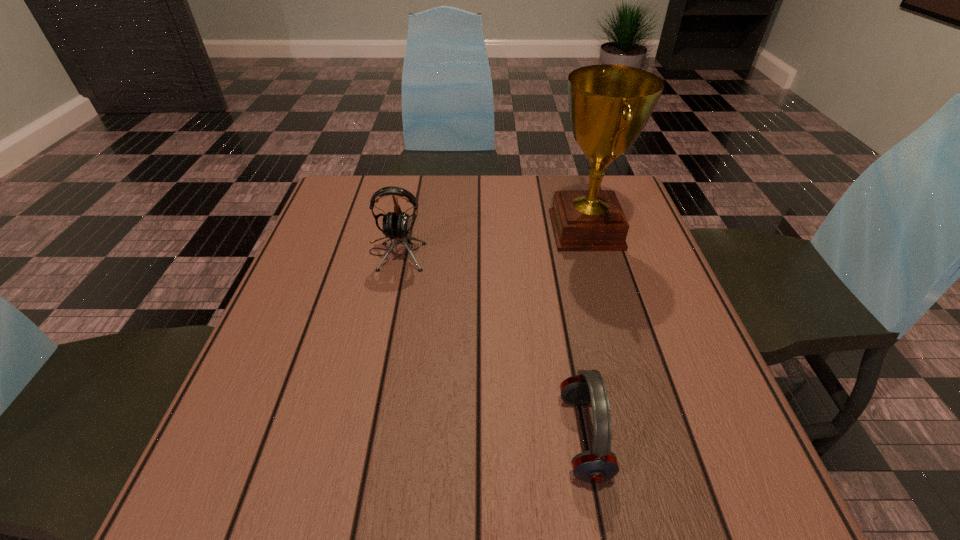
Locate an element on the screen. free space located on the ear cups of the shorter earphone is located at coordinates (328, 437).

You are a GUI agent. You are given a task and a screenshot of the screen. Output one action in this format:
    pyautogui.click(x=<x>, y=<y>)
    Task: Click on the vacant space situated 0.250m on the ear cups of the shorter earphone
    
    Given the screenshot: What is the action you would take?
    pyautogui.click(x=409, y=437)

The width and height of the screenshot is (960, 540). Identify the location of object at the far edge. coord(609,105).

Locate an element on the screen. The image size is (960, 540). object located in the near edge section of the desktop is located at coordinates (599, 465).

This screenshot has height=540, width=960. In order to click on object that is at the left edge in this screenshot , I will do `click(396, 225)`.

Where is `object at the right edge`? object at the right edge is located at coordinates (609, 105).

Identify the location of object that is at the far right corner. (609, 105).

This screenshot has width=960, height=540. In the image, there is a desktop. Find the location of `free space at the far edge`. free space at the far edge is located at coordinates (540, 198).

You are a GUI agent. You are given a task and a screenshot of the screen. Output one action in this format:
    pyautogui.click(x=<x>, y=<y>)
    Task: Click on the free space at the near edge
    This screenshot has height=540, width=960.
    Given the screenshot: What is the action you would take?
    pyautogui.click(x=345, y=468)

The height and width of the screenshot is (540, 960). I want to click on vacant area at the left edge of the desktop, so click(362, 282).